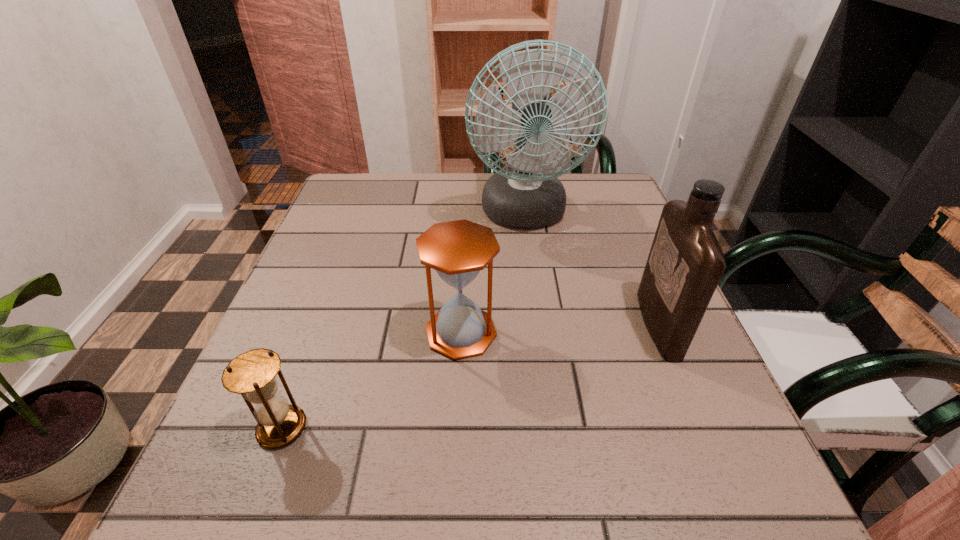
You are a GUI agent. You are given a task and a screenshot of the screen. Output one action in this format:
    pyautogui.click(x=<x>, y=<y>)
    Task: Click on the vacant space located on the label side of the liquor
    The height and width of the screenshot is (540, 960).
    Given the screenshot: What is the action you would take?
    pyautogui.click(x=478, y=324)

At what (x,y) coordinates should I click in order to perform the action: click on vacant point located 0.100m on the label side of the liquor. Please return your answer as a coordinate pair (x, y). The width and height of the screenshot is (960, 540). Looking at the image, I should click on (x=592, y=324).

At what (x,y) coordinates should I click in order to perform the action: click on blank area located 0.070m on the front of the farther hourglass. Please return your answer as a coordinate pair (x, y). The height and width of the screenshot is (540, 960). Looking at the image, I should click on (458, 395).

Identify the location of free spot located on the back of the shorter hourglass. (334, 287).

Find the location of a particular element. Image resolution: width=960 pixels, height=540 pixels. object that is at the far edge is located at coordinates (527, 196).

The image size is (960, 540). I want to click on object located in the left edge section of the desktop, so click(x=252, y=374).

Locate an element on the screen. This screenshot has height=540, width=960. fan positioned at the right edge is located at coordinates (527, 196).

The height and width of the screenshot is (540, 960). Identify the location of liquor that is at the right edge. (685, 264).

Identify the location of object present at the far right corner. The image size is (960, 540). (527, 196).

Where is `vacant space at the far edge of the desktop`? vacant space at the far edge of the desktop is located at coordinates (444, 208).